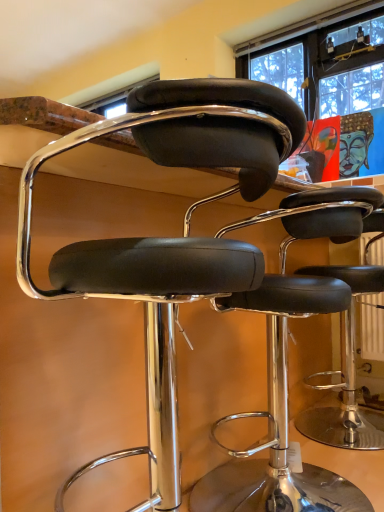
Question: From a real-world perspective, is black leather stool at center, marked as the second chair in a front-to-back arrangement, below black leather stool at center, the second chair from the back?

Choices:
 (A) yes
 (B) no

Answer: (A)

Question: Is black leather stool at center, which appears as the 1th chair when viewed from the back, smaller than black leather stool at center, the first chair from the front?

Choices:
 (A) yes
 (B) no

Answer: (A)

Question: Can you confirm if black leather stool at center, marked as the second chair in a front-to-back arrangement, is positioned to the left of black leather stool at center, the first chair from the front?

Choices:
 (A) no
 (B) yes

Answer: (A)

Question: From the image's perspective, is black leather stool at center, which appears as the 1th chair when viewed from the back, over black leather stool at center, the first chair from the front?

Choices:
 (A) yes
 (B) no

Answer: (B)

Question: Considering the relative sizes of black leather stool at center, which appears as the 1th chair when viewed from the back, and black leather stool at center, the second chair from the back, in the image provided, is black leather stool at center, which appears as the 1th chair when viewed from the back, wider than black leather stool at center, the second chair from the back,?

Choices:
 (A) yes
 (B) no

Answer: (B)

Question: Can you confirm if black leather stool at center, which appears as the 1th chair when viewed from the back, is shorter than black leather stool at center, the second chair from the back?

Choices:
 (A) yes
 (B) no

Answer: (A)

Question: Does black leather stool at center, the first chair from the front, have a greater width compared to black leather stool at center, marked as the second chair in a front-to-back arrangement?

Choices:
 (A) yes
 (B) no

Answer: (A)

Question: Is black leather stool at center, the second chair from the back, not within black leather stool at center, which appears as the 1th chair when viewed from the back?

Choices:
 (A) yes
 (B) no

Answer: (A)

Question: From a real-world perspective, is black leather stool at center, the first chair from the front, located higher than black leather stool at center, marked as the second chair in a front-to-back arrangement?

Choices:
 (A) no
 (B) yes

Answer: (B)

Question: Considering the relative sizes of black leather stool at center, the first chair from the front, and black leather stool at center, which appears as the 1th chair when viewed from the back, in the image provided, is black leather stool at center, the first chair from the front, shorter than black leather stool at center, which appears as the 1th chair when viewed from the back,?

Choices:
 (A) yes
 (B) no

Answer: (B)

Question: Is black leather stool at center, the second chair from the back, to the left of black leather stool at center, which appears as the 1th chair when viewed from the back, from the viewer's perspective?

Choices:
 (A) yes
 (B) no

Answer: (A)

Question: Is black leather stool at center, the second chair from the back, bigger than black leather stool at center, which appears as the 1th chair when viewed from the back?

Choices:
 (A) no
 (B) yes

Answer: (B)

Question: Considering their positions, is black leather stool at center, the first chair from the front, located in front of or behind black leather stool at center, which appears as the 1th chair when viewed from the back?

Choices:
 (A) front
 (B) behind

Answer: (A)